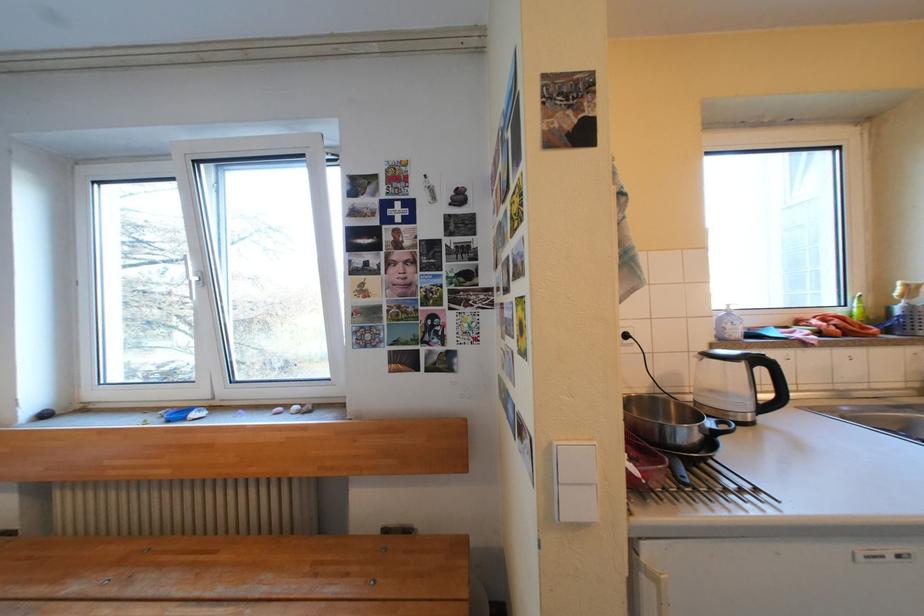
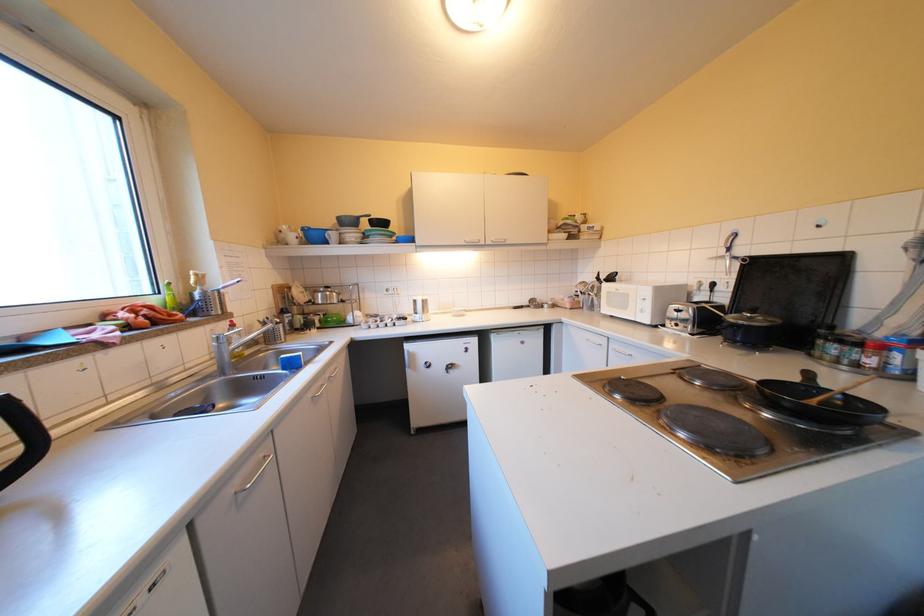
Find the pixel in the second image that matches point 853,312 in the first image.

(167, 300)